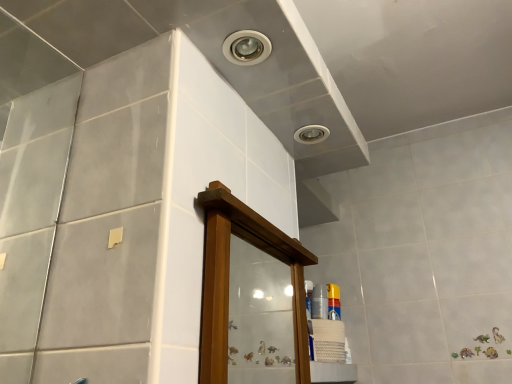
What is the approximate width of brown wooden screen door at center?

brown wooden screen door at center is 2.48 inches in width.

You are a GUI agent. You are given a task and a screenshot of the screen. Output one action in this format:
    pyautogui.click(x=<x>, y=<y>)
    Task: Click on the brown wooden screen door at center
    The height and width of the screenshot is (384, 512).
    Given the screenshot: What is the action you would take?
    pyautogui.click(x=216, y=295)

What do you see at coordinates (216, 295) in the screenshot? This screenshot has width=512, height=384. I see `brown wooden screen door at center` at bounding box center [216, 295].

I want to click on brown wooden screen door at center, so click(216, 295).